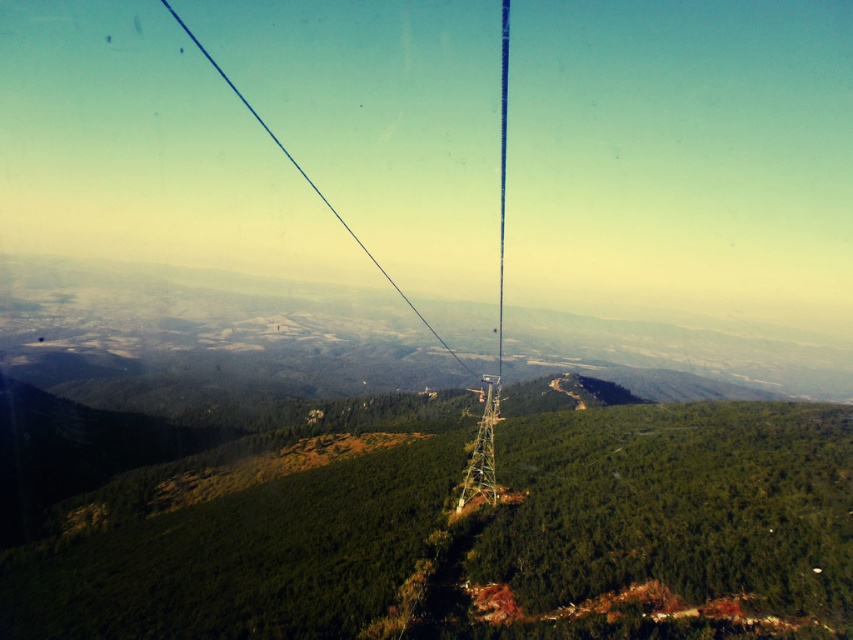
Question: Among these objects, which one is nearest to the camera?

Choices:
 (A) blue wire at center
 (B) metallic silver cable at center

Answer: (A)

Question: Is blue wire at center further to camera compared to metallic silver cable at center?

Choices:
 (A) no
 (B) yes

Answer: (A)

Question: Which point is closer to the camera?

Choices:
 (A) (238, 92)
 (B) (502, 122)

Answer: (A)

Question: Can you confirm if blue wire at center is thinner than metallic silver cable at center?

Choices:
 (A) yes
 (B) no

Answer: (B)

Question: Can you confirm if blue wire at center is smaller than metallic silver cable at center?

Choices:
 (A) yes
 (B) no

Answer: (B)

Question: Among these objects, which one is nearest to the camera?

Choices:
 (A) blue wire at center
 (B) metallic silver cable at center

Answer: (A)